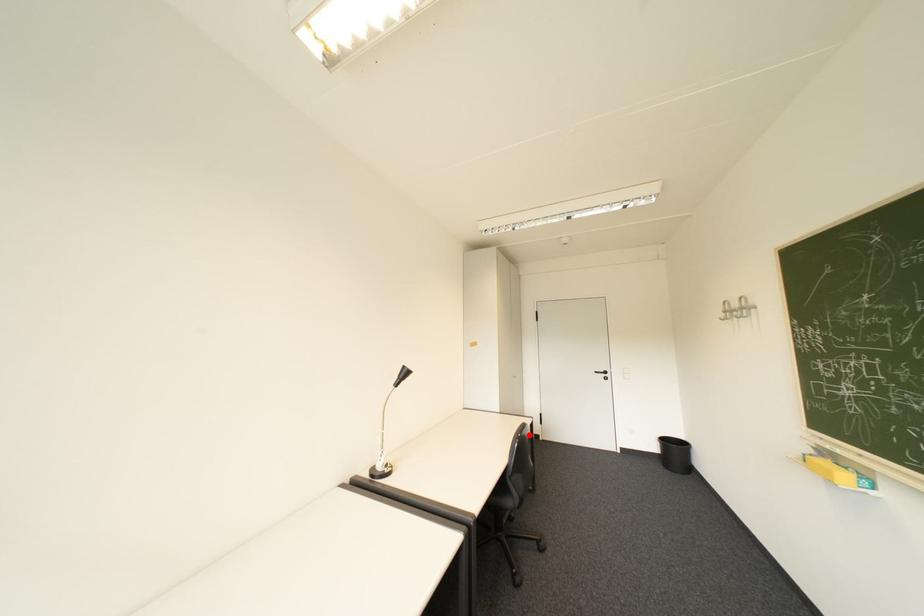
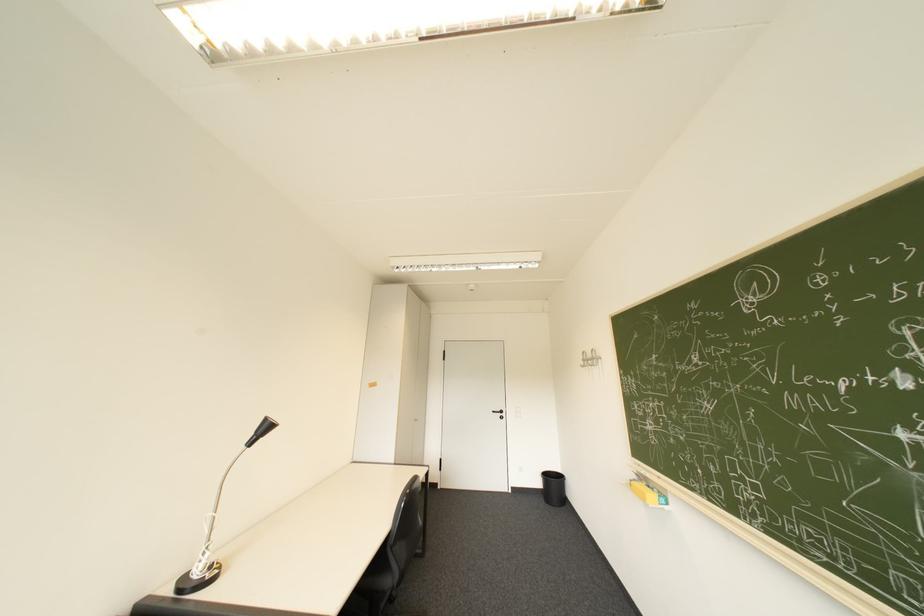
Question: I am providing you with two images of the same scene from different viewpoints. In image1, a red point is highlighted. Considering the same 3D point in image2, which of the following is correct?

Choices:
 (A) It is closer
 (B) It is farther

Answer: (A)